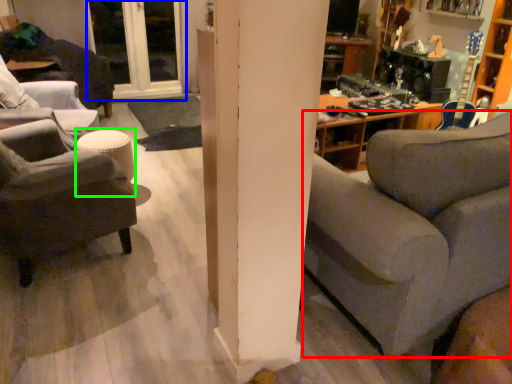
Question: Which object is positioned farthest from studio couch (highlighted by a red box)? Select from window (highlighted by a blue box) and stool (highlighted by a green box).

Choices:
 (A) window
 (B) stool

Answer: (A)